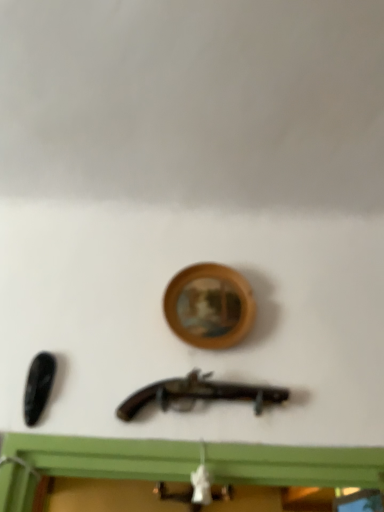
Question: Could you tell me if wooden picture frame at center is facing matte black revolver at center?

Choices:
 (A) yes
 (B) no

Answer: (B)

Question: Is matte black revolver at center at the back of wooden picture frame at center?

Choices:
 (A) yes
 (B) no

Answer: (B)

Question: From a real-world perspective, is wooden picture frame at center located beneath matte black revolver at center?

Choices:
 (A) yes
 (B) no

Answer: (B)

Question: Is wooden picture frame at center thinner than matte black revolver at center?

Choices:
 (A) no
 (B) yes

Answer: (B)

Question: Is wooden picture frame at center bigger than matte black revolver at center?

Choices:
 (A) no
 (B) yes

Answer: (B)

Question: From the image's perspective, is wooden picture frame at center beneath matte black revolver at center?

Choices:
 (A) no
 (B) yes

Answer: (A)

Question: Would you say matte black revolver at center contains wooden picture frame at center?

Choices:
 (A) no
 (B) yes

Answer: (A)

Question: Is matte black revolver at center wider than wooden picture frame at center?

Choices:
 (A) yes
 (B) no

Answer: (A)

Question: Does matte black revolver at center have a lesser width compared to wooden picture frame at center?

Choices:
 (A) yes
 (B) no

Answer: (B)

Question: Does matte black revolver at center have a smaller size compared to wooden picture frame at center?

Choices:
 (A) no
 (B) yes

Answer: (B)

Question: Is matte black revolver at center positioned in front of wooden picture frame at center?

Choices:
 (A) yes
 (B) no

Answer: (A)

Question: Is matte black revolver at center to the left of wooden picture frame at center from the viewer's perspective?

Choices:
 (A) no
 (B) yes

Answer: (B)

Question: From a real-world perspective, is matte black revolver at center above or below wooden picture frame at center?

Choices:
 (A) above
 (B) below

Answer: (B)